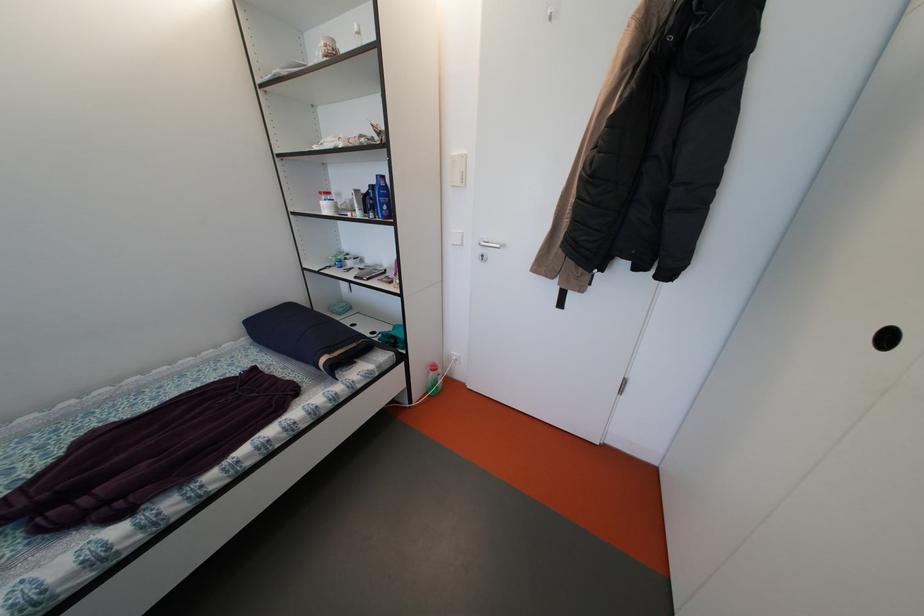
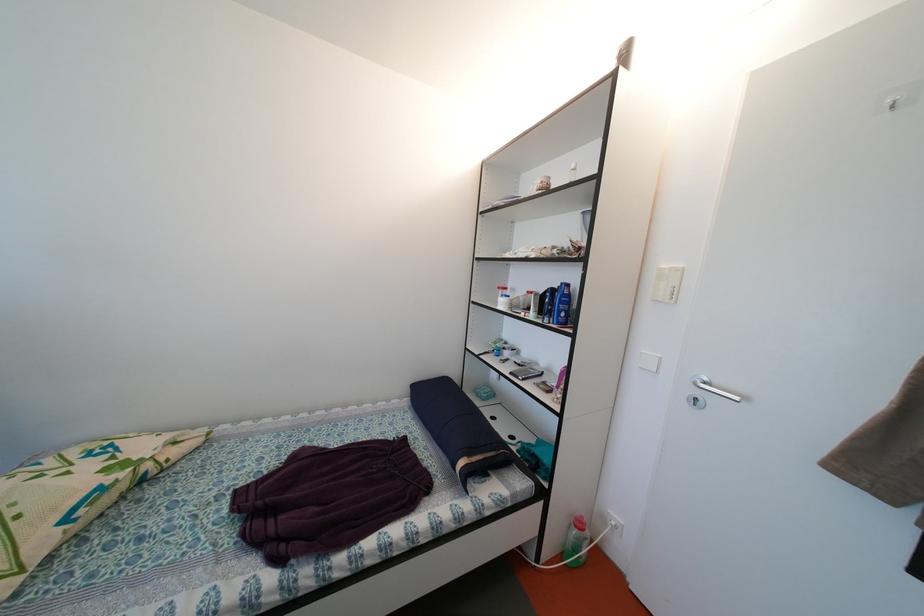
Find the pixel in the second image that matches (x=441, y=373) in the first image.

(587, 530)